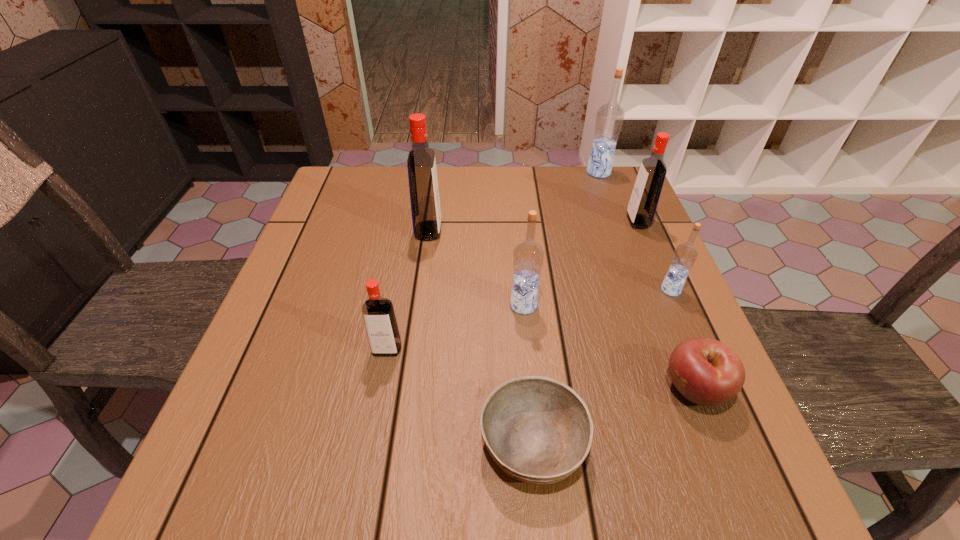
What are the coordinates of `free point located on the side of the apple with the unique marking` in the screenshot? It's located at (585, 389).

I want to click on free space located on the side of the apple with the unique marking, so click(612, 389).

You are a GUI agent. You are given a task and a screenshot of the screen. Output one action in this format:
    pyautogui.click(x=<x>, y=<y>)
    Task: Click on the free spot located 0.090m on the left of the bowl
    This screenshot has width=960, height=540.
    Given the screenshot: What is the action you would take?
    pyautogui.click(x=424, y=443)

At what (x,y) coordinates should I click in order to perform the action: click on object that is positioned at the near edge. Please return your answer as a coordinate pair (x, y). The width and height of the screenshot is (960, 540). Looking at the image, I should click on (538, 430).

Identify the location of apple that is at the right edge. The height and width of the screenshot is (540, 960). (705, 371).

I want to click on free region at the far edge, so click(x=378, y=212).

Locate an element on the screen. vacant area at the left edge is located at coordinates (252, 392).

You are a GUI agent. You are given a task and a screenshot of the screen. Output one action in this format:
    pyautogui.click(x=<x>, y=<y>)
    Task: Click on the vacant area at the right edge
    
    Given the screenshot: What is the action you would take?
    pyautogui.click(x=649, y=240)

In the image, there is a desktop. Identify the location of vacant space at the far left corner. This screenshot has height=540, width=960. (380, 177).

In the image, there is a desktop. Where is `free space at the far right corner`? The height and width of the screenshot is (540, 960). free space at the far right corner is located at coordinates (586, 166).